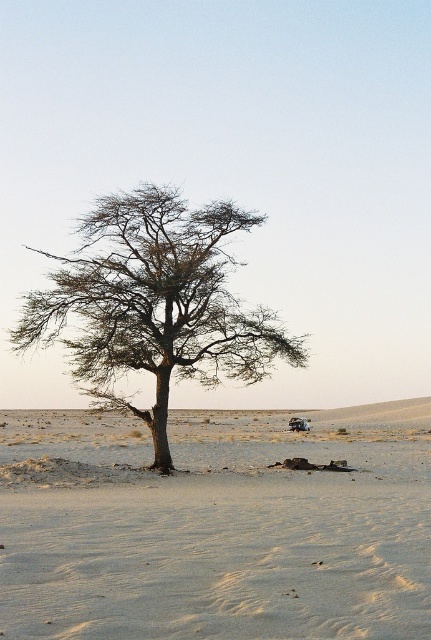
You are a desert explorer trying to navigate between the sandy beige sand at center and the brown textured tree at center. Which path would you choose to walk on if you want to cover more ground with fewer steps? Explain your reasoning based on the scene description.

The sandy beige sand at center has a larger width than the brown textured tree at center. Therefore, walking on the sandy beige sand at center would allow you to cover more ground with fewer steps since it is wider.